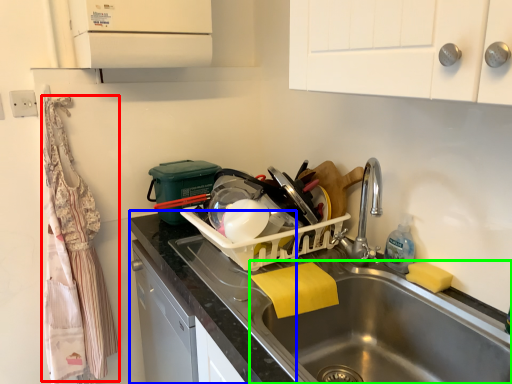
Question: Which is nearer to the material (highlighted by a red box)? counter top (highlighted by a blue box) or sink (highlighted by a green box).

Choices:
 (A) counter top
 (B) sink

Answer: (A)